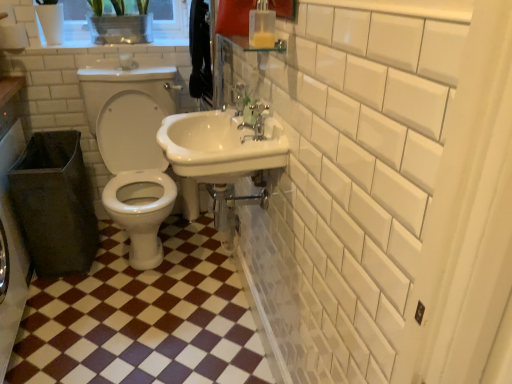
Question: Is clear plastic container at upper left bigger than brown glossy tile at center?

Choices:
 (A) yes
 (B) no

Answer: (B)

Question: Does clear plastic container at upper left appear on the right side of brown glossy tile at center?

Choices:
 (A) no
 (B) yes

Answer: (A)

Question: Is clear plastic container at upper left next to brown glossy tile at center?

Choices:
 (A) no
 (B) yes

Answer: (A)

Question: Considering the relative sizes of clear plastic container at upper left and brown glossy tile at center in the image provided, is clear plastic container at upper left smaller than brown glossy tile at center?

Choices:
 (A) yes
 (B) no

Answer: (A)

Question: Does clear plastic container at upper left have a lesser width compared to brown glossy tile at center?

Choices:
 (A) no
 (B) yes

Answer: (B)

Question: Is brown glossy tile at center surrounded by clear plastic container at upper left?

Choices:
 (A) no
 (B) yes

Answer: (A)

Question: Is the depth of white glossy toilet at center greater than that of clear plastic container at upper left?

Choices:
 (A) yes
 (B) no

Answer: (B)

Question: From a real-world perspective, is white glossy toilet at center below clear plastic container at upper left?

Choices:
 (A) yes
 (B) no

Answer: (A)

Question: Can you confirm if white glossy toilet at center is taller than clear plastic container at upper left?

Choices:
 (A) no
 (B) yes

Answer: (B)

Question: Would you say white glossy toilet at center is a long distance from clear plastic container at upper left?

Choices:
 (A) no
 (B) yes

Answer: (A)

Question: Is white glossy toilet at center looking in the opposite direction of clear plastic container at upper left?

Choices:
 (A) yes
 (B) no

Answer: (B)

Question: Can we say white glossy toilet at center lies outside clear plastic container at upper left?

Choices:
 (A) yes
 (B) no

Answer: (A)

Question: Is brown glossy tile at center completely or partially outside of white glossy sink at center?

Choices:
 (A) yes
 (B) no

Answer: (A)